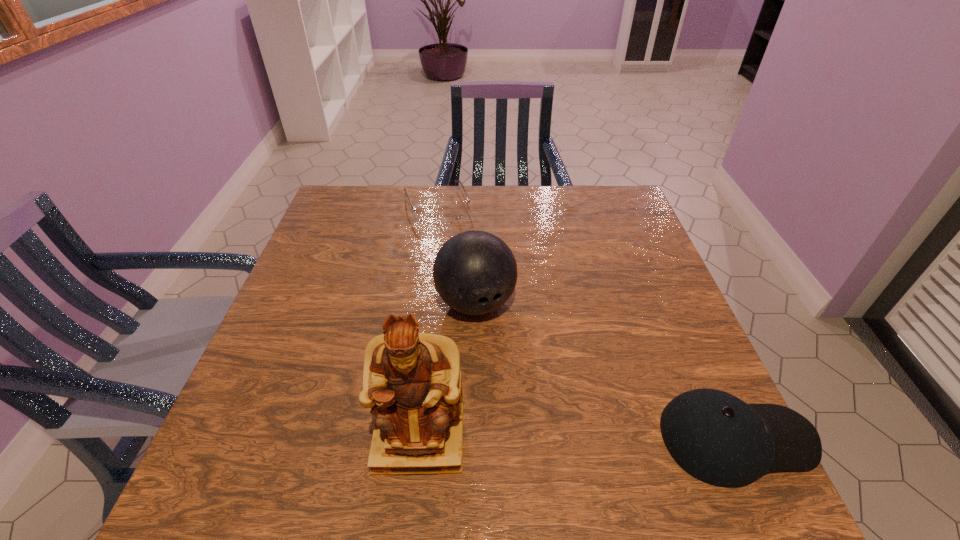
Image resolution: width=960 pixels, height=540 pixels. I want to click on vacant space on the desktop that is between the figurine and the baseball cap and is positioned on the front-facing side of the farthest object, so click(541, 438).

This screenshot has width=960, height=540. What are the coordinates of `free spot on the desktop that is between the figurine and the rightmost object and is positioned on the grip area of the second tallest object` in the screenshot? It's located at (548, 438).